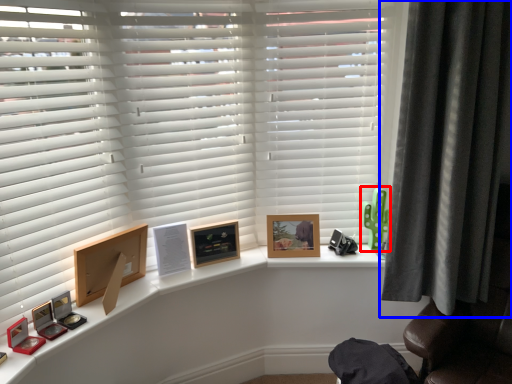
Question: Which point is closer to the camera, toy (highlighted by a red box) or curtain (highlighted by a blue box)?

Choices:
 (A) toy
 (B) curtain

Answer: (B)